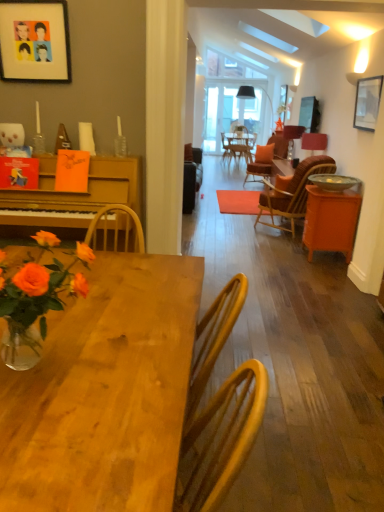
Question: Is metallic silver picture frame at upper right bigger than matte black lampshade at upper center, which is counted as the second lamp, starting from the bottom?

Choices:
 (A) no
 (B) yes

Answer: (A)

Question: From the image's perspective, is metallic silver picture frame at upper right over matte black lampshade at upper center, the first lamp from the top?

Choices:
 (A) yes
 (B) no

Answer: (B)

Question: Does metallic silver picture frame at upper right lie behind matte black lampshade at upper center, the first lamp from the top?

Choices:
 (A) no
 (B) yes

Answer: (A)

Question: Can you confirm if metallic silver picture frame at upper right is taller than matte black lampshade at upper center, which is counted as the second lamp, starting from the bottom?

Choices:
 (A) no
 (B) yes

Answer: (A)

Question: Is matte black lampshade at upper center, which is counted as the second lamp, starting from the bottom, at the back of metallic silver picture frame at upper right?

Choices:
 (A) no
 (B) yes

Answer: (A)

Question: Can you confirm if metallic silver picture frame at upper right is shorter than matte black lampshade at upper center, the first lamp from the top?

Choices:
 (A) no
 (B) yes

Answer: (B)

Question: Can you confirm if orange matte cabinet at right is positioned to the left of translucent glass vase at lower left?

Choices:
 (A) yes
 (B) no

Answer: (B)

Question: Is the position of orange matte cabinet at right less distant than that of translucent glass vase at lower left?

Choices:
 (A) no
 (B) yes

Answer: (A)

Question: Is orange matte cabinet at right located outside translucent glass vase at lower left?

Choices:
 (A) yes
 (B) no

Answer: (A)

Question: From the image's perspective, is orange matte cabinet at right above translucent glass vase at lower left?

Choices:
 (A) yes
 (B) no

Answer: (A)

Question: Can you confirm if orange matte cabinet at right is smaller than translucent glass vase at lower left?

Choices:
 (A) no
 (B) yes

Answer: (A)

Question: Considering the relative positions of orange matte cabinet at right and translucent glass vase at lower left in the image provided, is orange matte cabinet at right behind translucent glass vase at lower left?

Choices:
 (A) yes
 (B) no

Answer: (A)

Question: Can you confirm if metallic silver bowl at right is smaller than translucent glass vase at lower left?

Choices:
 (A) no
 (B) yes

Answer: (B)